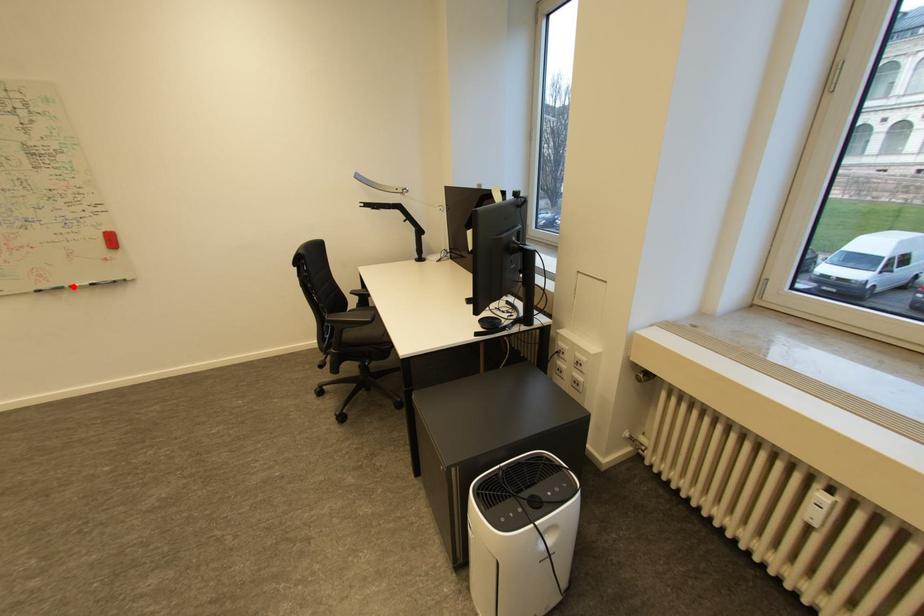
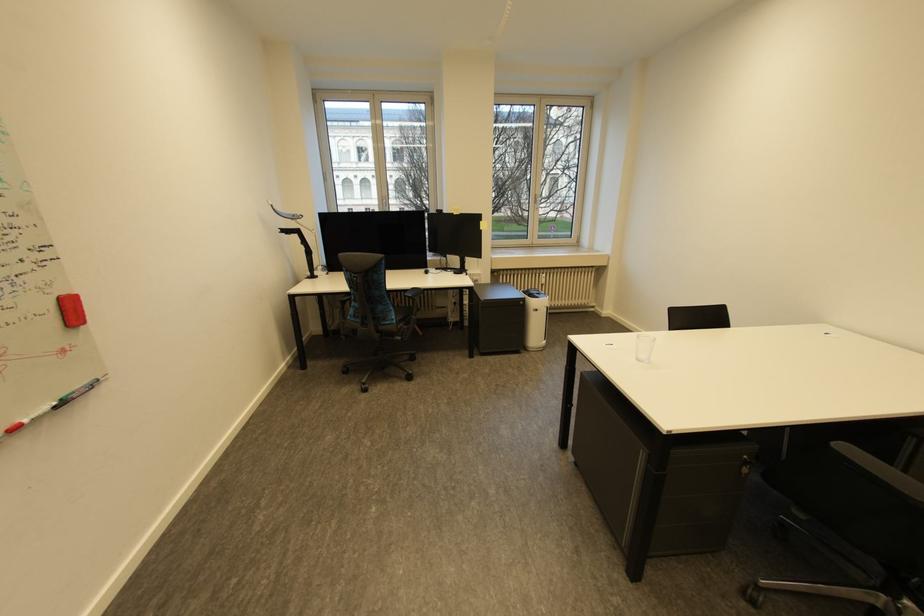
The point at the highlighted location is marked in the first image. Where is the corresponding point in the second image?

(6, 436)